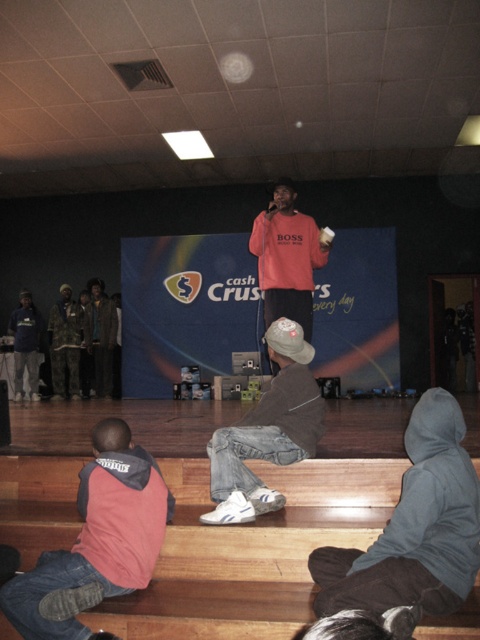
Which is more to the right, pink fleece vest at lower left or denim jeans at center?

denim jeans at center is more to the right.

Does pink fleece vest at lower left appear on the left side of denim jeans at center?

Indeed, pink fleece vest at lower left is positioned on the left side of denim jeans at center.

Is point (26, 609) positioned in front of point (316, 387)?

Yes, it is.

You are a GUI agent. You are given a task and a screenshot of the screen. Output one action in this format:
    pyautogui.click(x=<x>, y=<y>)
    Task: Click on the pink fleece vest at lower left
    This screenshot has height=640, width=480.
    Given the screenshot: What is the action you would take?
    pyautogui.click(x=96, y=540)

Between point (238, 472) and point (275, 372), which one is positioned in front?

Point (238, 472)

Can you confirm if denim jeans at center is positioned to the right of matte pink sweatshirt at center?

No, denim jeans at center is not to the right of matte pink sweatshirt at center.

In order to click on denim jeans at center in this screenshot , I will do `click(266, 432)`.

Which of these two, wooden floor at lower center or matte pink sweatshirt at center, stands taller?

matte pink sweatshirt at center is taller.

Which of these two, wooden floor at lower center or matte pink sweatshirt at center, stands shorter?

Standing shorter between the two is wooden floor at lower center.

Does point (39, 413) lie in front of point (267, 234)?

No, (39, 413) is behind (267, 234).

The image size is (480, 640). Find the location of `wooden floor at lower center`. wooden floor at lower center is located at coordinates (208, 508).